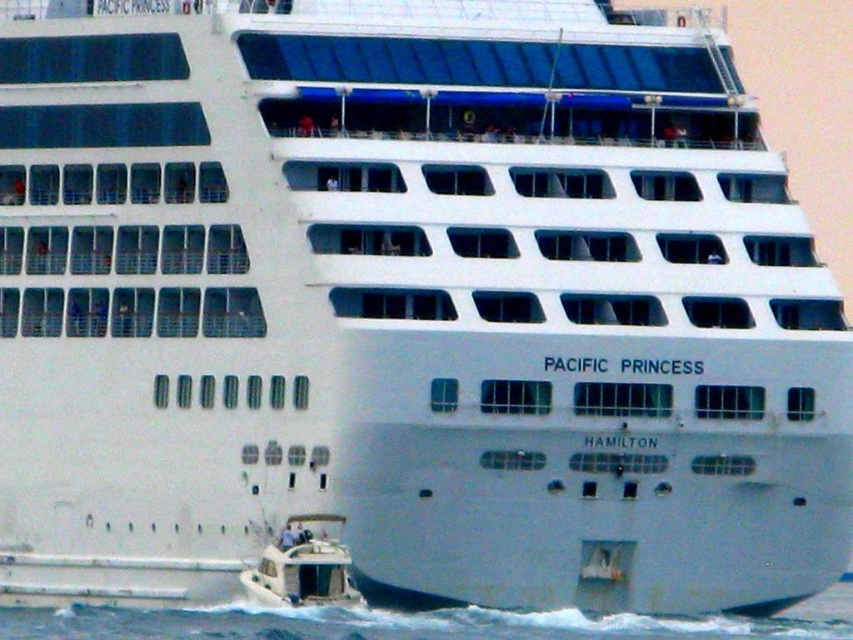
Consider the image. You are standing on the deck of the Pacific Princess cruise ship and looking out. There is a point marked at coordinates (x=419, y=624). Based on the scene, what is the location of this point relative to the ship?

The point at coordinates (x=419, y=624) corresponds to blue water at lower left, which is located below and to the left of the ship.

You are standing on the deck of the Pacific Princess cruise ship and looking out towards the front of the ship. You see the blue water at lower left and the white glossy motorboat at lower left. Which one is positioned to the right from your perspective?

The blue water at lower left is positioned to the right of the white glossy motorboat at lower left.

You are standing on the deck of the Pacific Princess cruise ship and looking towards the front of the ship. Which direction should you look to see the blue water at lower left?

The blue water at lower left is located at point (419,624), so you should look towards the lower left direction to see it.